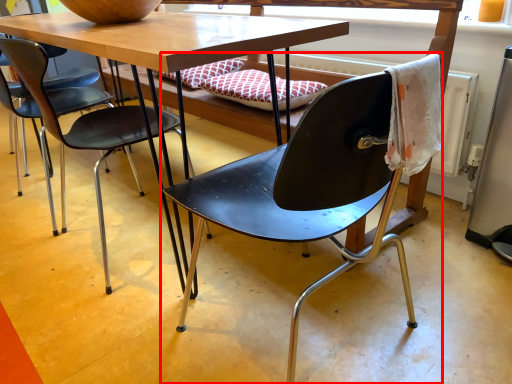
Question: From the image's perspective, what is the correct spatial relationship of chair (annotated by the red box) in relation to chair?

Choices:
 (A) below
 (B) above

Answer: (A)